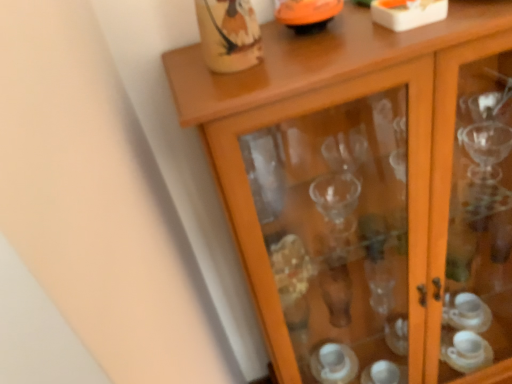
Question: From a real-world perspective, is transparent glass cabinet at upper center over orange glossy bowl at upper center?

Choices:
 (A) yes
 (B) no

Answer: (B)

Question: Is transparent glass cabinet at upper center far away from orange glossy bowl at upper center?

Choices:
 (A) no
 (B) yes

Answer: (A)

Question: Is transparent glass cabinet at upper center bigger than orange glossy bowl at upper center?

Choices:
 (A) yes
 (B) no

Answer: (A)

Question: Does transparent glass cabinet at upper center come in front of orange glossy bowl at upper center?

Choices:
 (A) no
 (B) yes

Answer: (B)

Question: Does transparent glass cabinet at upper center contain orange glossy bowl at upper center?

Choices:
 (A) no
 (B) yes

Answer: (A)

Question: Does transparent glass cabinet at upper center have a greater height compared to orange glossy bowl at upper center?

Choices:
 (A) yes
 (B) no

Answer: (A)

Question: From the image's perspective, is orange glossy bowl at upper center under transparent glass cabinet at upper center?

Choices:
 (A) no
 (B) yes

Answer: (A)

Question: Can transparent glass cabinet at upper center be found inside orange glossy bowl at upper center?

Choices:
 (A) yes
 (B) no

Answer: (B)

Question: Does orange glossy bowl at upper center have a larger size compared to transparent glass cabinet at upper center?

Choices:
 (A) yes
 (B) no

Answer: (B)

Question: From the image's perspective, would you say orange glossy bowl at upper center is positioned over transparent glass cabinet at upper center?

Choices:
 (A) no
 (B) yes

Answer: (B)

Question: Is orange glossy bowl at upper center placed right next to transparent glass cabinet at upper center?

Choices:
 (A) no
 (B) yes

Answer: (A)

Question: Considering the relative sizes of orange glossy bowl at upper center and transparent glass cabinet at upper center in the image provided, is orange glossy bowl at upper center smaller than transparent glass cabinet at upper center?

Choices:
 (A) no
 (B) yes

Answer: (B)

Question: Is orange glossy bowl at upper center bigger or smaller than transparent glass cabinet at upper center?

Choices:
 (A) big
 (B) small

Answer: (B)